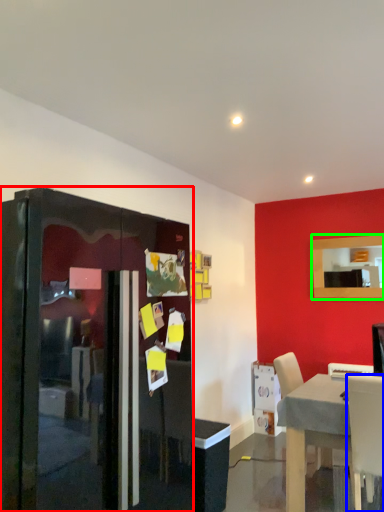
Question: Considering the real-world distances, which object is closest to fridge (highlighted by a red box)? chair (highlighted by a blue box) or mirror (highlighted by a green box).

Choices:
 (A) chair
 (B) mirror

Answer: (A)